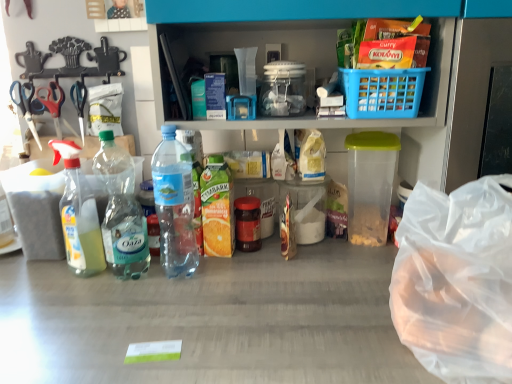
Question: Which direction should I rotate to face translucent plastic bottle at center, placed as the third bottle when sorted from left to right, — up or down?

Choices:
 (A) up
 (B) down

Answer: (B)

Question: Can red plastic scissors at left, which is the 2th scissors from right to left, be found inside clear plastic bottle at left, positioned as the second bottle in left-to-right order?

Choices:
 (A) yes
 (B) no

Answer: (B)

Question: From the image's perspective, is clear plastic bottle at left, which is the second bottle from right to left, below red plastic scissors at left, placed as the 2th scissors when sorted from left to right?

Choices:
 (A) no
 (B) yes

Answer: (B)

Question: Does clear plastic bottle at left, positioned as the second bottle in left-to-right order, have a greater height compared to red plastic scissors at left, which is the 2th scissors from right to left?

Choices:
 (A) no
 (B) yes

Answer: (B)

Question: Does clear plastic bottle at left, which is the second bottle from right to left, touch red plastic scissors at left, placed as the 2th scissors when sorted from left to right?

Choices:
 (A) no
 (B) yes

Answer: (A)

Question: Is clear plastic bottle at left, positioned as the second bottle in left-to-right order, thinner than red plastic scissors at left, placed as the 2th scissors when sorted from left to right?

Choices:
 (A) yes
 (B) no

Answer: (B)

Question: Is the depth of clear plastic bottle at left, which is the second bottle from right to left, greater than that of red plastic scissors at left, placed as the 2th scissors when sorted from left to right?

Choices:
 (A) no
 (B) yes

Answer: (A)

Question: Is clear plastic bottle at left, positioned as the second bottle in left-to-right order, outside translucent plastic bottle at center, the first bottle viewed from the right?

Choices:
 (A) no
 (B) yes

Answer: (B)

Question: Considering the relative sizes of clear plastic bottle at left, which is the second bottle from right to left, and translucent plastic bottle at center, placed as the third bottle when sorted from left to right, in the image provided, is clear plastic bottle at left, which is the second bottle from right to left, smaller than translucent plastic bottle at center, placed as the third bottle when sorted from left to right,?

Choices:
 (A) no
 (B) yes

Answer: (B)

Question: Does clear plastic bottle at left, positioned as the second bottle in left-to-right order, come in front of translucent plastic bottle at center, the first bottle viewed from the right?

Choices:
 (A) no
 (B) yes

Answer: (A)

Question: Is clear plastic bottle at left, positioned as the second bottle in left-to-right order, to the left of translucent plastic bottle at center, the first bottle viewed from the right, from the viewer's perspective?

Choices:
 (A) yes
 (B) no

Answer: (A)

Question: Does clear plastic bottle at left, positioned as the second bottle in left-to-right order, have a lesser height compared to translucent plastic bottle at center, the first bottle viewed from the right?

Choices:
 (A) yes
 (B) no

Answer: (A)

Question: From the image's perspective, would you say clear plastic bottle at left, which is the second bottle from right to left, is positioned over translucent plastic bottle at center, the first bottle viewed from the right?

Choices:
 (A) no
 (B) yes

Answer: (A)

Question: Are red plastic scissors at left, placed as the 2th scissors when sorted from left to right, and transparent plastic bag at lower right located far from each other?

Choices:
 (A) yes
 (B) no

Answer: (A)